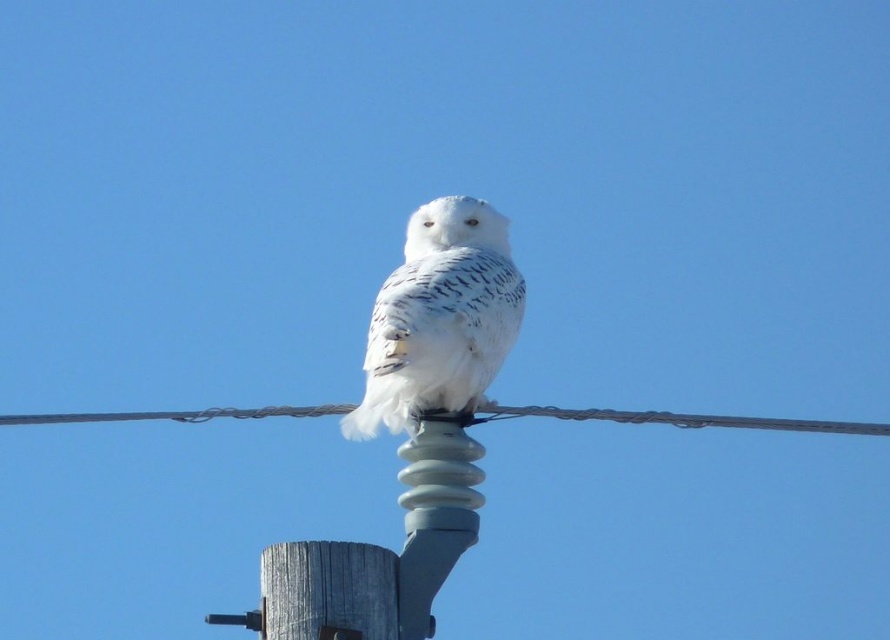
Question: Is white fluffy owl at center positioned before wooden post at lower left?

Choices:
 (A) yes
 (B) no

Answer: (B)

Question: Is white fluffy owl at center wider than gray rubber insulator at center?

Choices:
 (A) yes
 (B) no

Answer: (A)

Question: Which point is closer to the camera?

Choices:
 (A) wooden post at lower left
 (B) white fluffy owl at center
 (C) black wire at center

Answer: (A)

Question: Considering the real-world distances, which object is closest to the wooden post at lower left?

Choices:
 (A) black wire at center
 (B) gray rubber insulator at center

Answer: (B)

Question: Which point is farther to the camera?

Choices:
 (A) (500, 236)
 (B) (279, 625)
 (C) (514, 413)

Answer: (A)

Question: Is gray rubber insulator at center further to the viewer compared to wooden post at lower left?

Choices:
 (A) yes
 (B) no

Answer: (A)